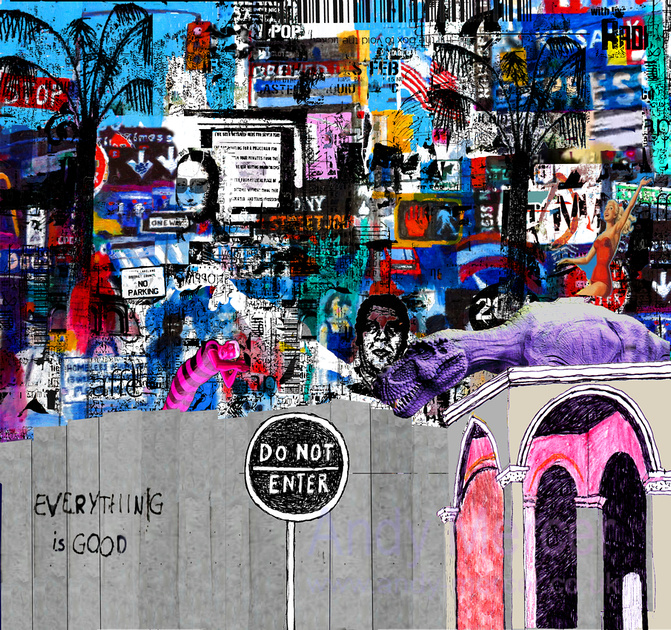
This screenshot has width=671, height=630. I want to click on wall, so click(160, 460).